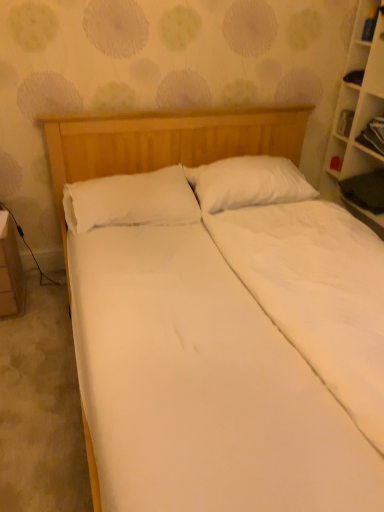
The height and width of the screenshot is (512, 384). Describe the element at coordinates (358, 114) in the screenshot. I see `white wooden bookcase at right` at that location.

What is the approximate height of white soft pillow at center, marked as the first pillow in a left-to-right arrangement?

9.24 inches.

Measure the distance between white glossy table at lower left and camera.

6.10 feet.

This screenshot has height=512, width=384. What do you see at coordinates (362, 121) in the screenshot? I see `wooden cabinet at right` at bounding box center [362, 121].

Locate an element on the screen. white soft pillow at center, which ranks as the second pillow in left-to-right order is located at coordinates (247, 183).

How many degrees apart are the facing directions of white soft pillow at center, the 2th pillow from the right, and wooden cabinet at right?

89.5 degrees.

Is point (150, 187) behind point (368, 106)?

No, it is in front of (368, 106).

Is white soft pillow at center, the 2th pillow from the right, beside wooden cabinet at right?

No, white soft pillow at center, the 2th pillow from the right, is not with wooden cabinet at right.

In the scene shown: From the image's perspective, is white soft pillow at center, the 2th pillow from the right, above wooden cabinet at right?

Actually, white soft pillow at center, the 2th pillow from the right, appears below wooden cabinet at right in the image.

Between wooden cabinet at right and white glossy table at lower left, which one has less height?

wooden cabinet at right.

Is wooden cabinet at right positioned far away from white glossy table at lower left?

Yes, wooden cabinet at right and white glossy table at lower left are located far from each other.

Between wooden cabinet at right and white glossy table at lower left, which one has larger width?

With larger width is white glossy table at lower left.

Based on their sizes in the image, would you say white glossy table at lower left is bigger or smaller than white soft pillow at center, the 2th pillow from the right?

In the image, white glossy table at lower left appears to be smaller than white soft pillow at center, the 2th pillow from the right.

From a real-world perspective, who is located higher, white glossy table at lower left or white soft pillow at center, marked as the first pillow in a left-to-right arrangement?

white soft pillow at center, marked as the first pillow in a left-to-right arrangement, from a real-world perspective.

Would you say white soft pillow at center, the 2th pillow from the right, is part of white glossy table at lower left's contents?

Definitely not — white soft pillow at center, the 2th pillow from the right, is not inside white glossy table at lower left.

Is wooden cabinet at right inside white wooden bookcase at right?

Yes, wooden cabinet at right is inside white wooden bookcase at right.

Considering the sizes of objects white wooden bookcase at right and wooden cabinet at right in the image provided, who is shorter, white wooden bookcase at right or wooden cabinet at right?

Standing shorter between the two is wooden cabinet at right.

Between wooden cabinet at right and white soft pillow at center, the 2th pillow from the right, which one has more height?

With more height is white soft pillow at center, the 2th pillow from the right.

Considering the relative sizes of wooden cabinet at right and white soft pillow at center, marked as the first pillow in a left-to-right arrangement, in the image provided, is wooden cabinet at right wider than white soft pillow at center, marked as the first pillow in a left-to-right arrangement,?

In fact, wooden cabinet at right might be narrower than white soft pillow at center, marked as the first pillow in a left-to-right arrangement.

Is wooden cabinet at right oriented towards white soft pillow at center, marked as the first pillow in a left-to-right arrangement?

Yes, wooden cabinet at right is aimed at white soft pillow at center, marked as the first pillow in a left-to-right arrangement.

From a real-world perspective, is wooden cabinet at right on white soft pillow at center, the 2th pillow from the right?

Yes, from a real-world perspective, wooden cabinet at right is above white soft pillow at center, the 2th pillow from the right.

Who is smaller, white glossy table at lower left or white wooden bookcase at right?

white glossy table at lower left is smaller.

Looking at this image, is white glossy table at lower left wider than white wooden bookcase at right?

Yes, white glossy table at lower left is wider than white wooden bookcase at right.

Does white glossy table at lower left have a greater height compared to white wooden bookcase at right?

No, white glossy table at lower left is not taller than white wooden bookcase at right.

How many degrees apart are the facing directions of white glossy table at lower left and white wooden bookcase at right?

white glossy table at lower left and white wooden bookcase at right are facing 89.8 degrees away from each other.

Based on the photo, between wooden cabinet at right and white wooden bookcase at right, which one has smaller size?

Smaller between the two is wooden cabinet at right.

Which is behind, point (358, 104) or point (362, 69)?

Positioned behind is point (362, 69).

What's the angular difference between wooden cabinet at right and white wooden bookcase at right's facing directions?

wooden cabinet at right and white wooden bookcase at right are facing 0.327 degrees away from each other.

Looking at their sizes, would you say wooden cabinet at right is wider or thinner than white wooden bookcase at right?

Clearly, wooden cabinet at right has less width compared to white wooden bookcase at right.

Identify the location of cabinet behind the white soft pillow at center, marked as the first pillow in a left-to-right arrangement. The image size is (384, 512). (362, 121).

You are a GUI agent. You are given a task and a screenshot of the screen. Output one action in this format:
    pyautogui.click(x=<x>, y=<y>)
    Task: Click on the cabinet located above the white glossy table at lower left (from a real-world perspective)
    This screenshot has width=384, height=512.
    Given the screenshot: What is the action you would take?
    [362, 121]

Based on their spatial positions, is white soft pillow at center, which ranks as the second pillow in left-to-right order, or white soft pillow at center, marked as the first pillow in a left-to-right arrangement, closer to wooden cabinet at right?

Among the two, white soft pillow at center, which ranks as the second pillow in left-to-right order, is located nearer to wooden cabinet at right.

When comparing their distances from wooden cabinet at right, does white wooden bookcase at right or white glossy table at lower left seem further?

white glossy table at lower left.

From the image, which object appears to be nearer to white wooden bookcase at right, white soft pillow at center, marked as the first pillow in a left-to-right arrangement, or white glossy table at lower left?

white soft pillow at center, marked as the first pillow in a left-to-right arrangement, lies closer to white wooden bookcase at right than the other object.

Based on their spatial positions, is wooden cabinet at right or white soft pillow at center, the 2th pillow from the right, further from white glossy table at lower left?

The object further to white glossy table at lower left is wooden cabinet at right.

When comparing their distances from white glossy table at lower left, does white soft pillow at center, marked as the first pillow in a left-to-right arrangement, or white wooden bookcase at right seem closer?

white soft pillow at center, marked as the first pillow in a left-to-right arrangement, is closer to white glossy table at lower left.

When comparing their distances from white soft pillow at center, which appears as the 1th pillow when viewed from the right, does wooden cabinet at right or white soft pillow at center, marked as the first pillow in a left-to-right arrangement, seem closer?

white soft pillow at center, marked as the first pillow in a left-to-right arrangement, lies closer to white soft pillow at center, which appears as the 1th pillow when viewed from the right, than the other object.

Considering their positions, is white wooden bookcase at right positioned closer to white soft pillow at center, which ranks as the second pillow in left-to-right order, than white glossy table at lower left?

The object closer to white soft pillow at center, which ranks as the second pillow in left-to-right order, is white wooden bookcase at right.

From the image, which object appears to be nearer to white soft pillow at center, which appears as the 1th pillow when viewed from the right, white soft pillow at center, the 2th pillow from the right, or white glossy table at lower left?

The object closer to white soft pillow at center, which appears as the 1th pillow when viewed from the right, is white soft pillow at center, the 2th pillow from the right.

Identify the location of cabinet located between white soft pillow at center, which appears as the 1th pillow when viewed from the right, and white wooden bookcase at right in the left-right direction. (362, 121).

The height and width of the screenshot is (512, 384). In order to click on pillow between white glossy table at lower left and white soft pillow at center, which ranks as the second pillow in left-to-right order, from left to right in this screenshot , I will do `click(130, 200)`.

Identify the location of pillow between white soft pillow at center, marked as the first pillow in a left-to-right arrangement, and white wooden bookcase at right from left to right. (247, 183).

You are a GUI agent. You are given a task and a screenshot of the screen. Output one action in this format:
    pyautogui.click(x=<x>, y=<y>)
    Task: Click on the cabinet between white soft pillow at center, marked as the first pillow in a left-to-right arrangement, and white wooden bookcase at right from left to right
    
    Given the screenshot: What is the action you would take?
    pyautogui.click(x=362, y=121)